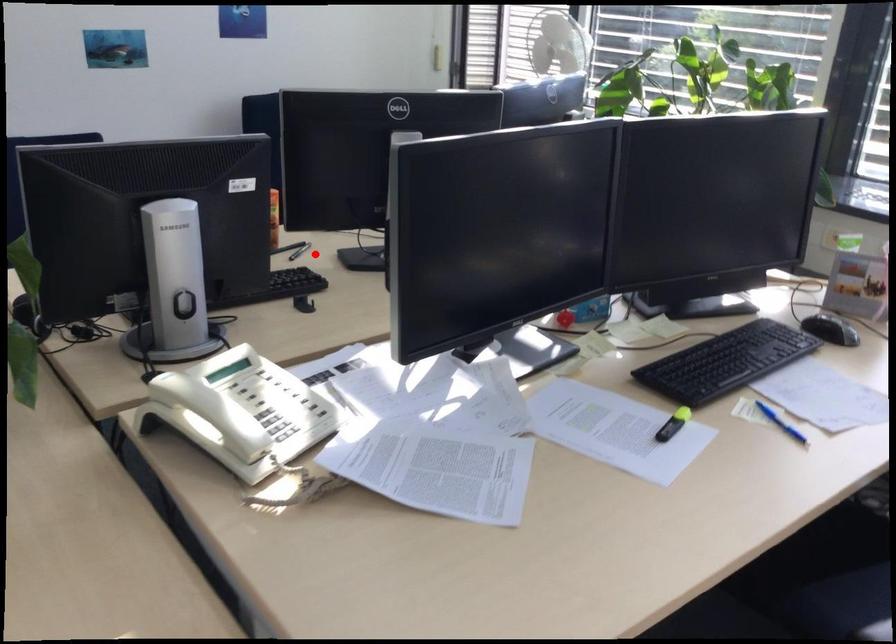
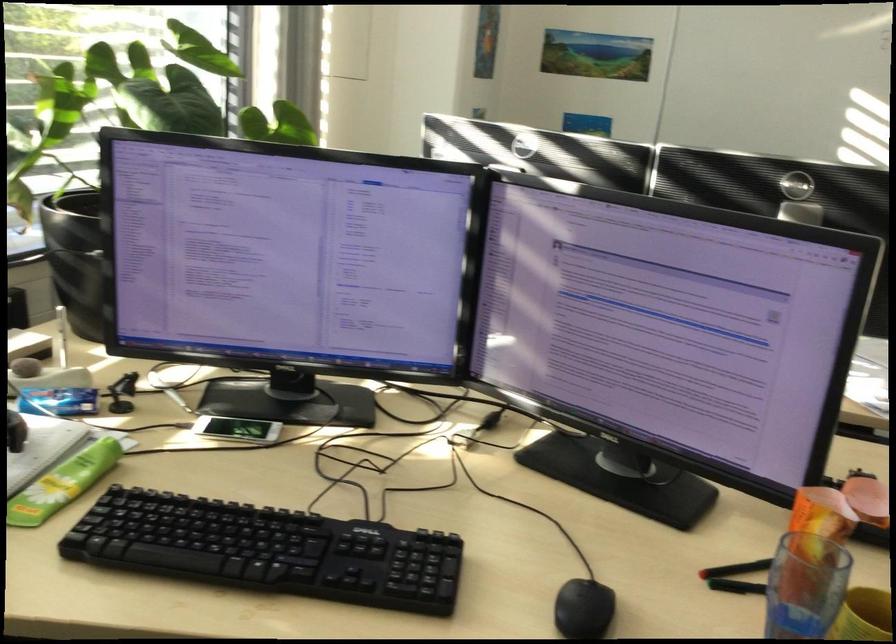
Locate, in the second image, the point that corresponds to the highlighted location in the first image.

(736, 569)